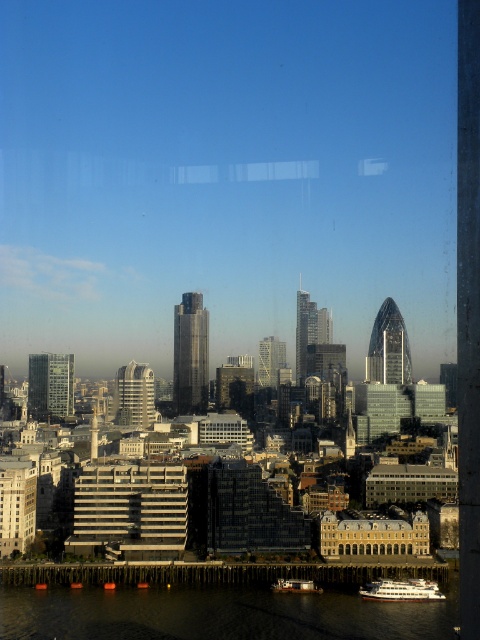
Is the position of dark water at lower center more distant than that of white glossy boat at lower right?

That is False.

Does point (386, 636) come closer to viewer compared to point (427, 589)?

Yes, it is.

At what (x,y) coordinates should I click in order to perform the action: click on dark water at lower center. Please return your answer as a coordinate pair (x, y). The width and height of the screenshot is (480, 640). Looking at the image, I should click on (216, 614).

Which is more to the right, white glossy boat at lower right or metallic gray boat at lower center?

white glossy boat at lower right is more to the right.

From the picture: Which of these two, white glossy boat at lower right or metallic gray boat at lower center, stands shorter?

metallic gray boat at lower center is shorter.

I want to click on white glossy boat at lower right, so click(x=402, y=589).

Looking at this image, is dark water at lower center to the right of metallic gray boat at lower center from the viewer's perspective?

Incorrect, dark water at lower center is not on the right side of metallic gray boat at lower center.

Between point (433, 620) and point (308, 580), which one is positioned in front?

Point (433, 620)

Is point (456, 580) farther from viewer compared to point (295, 582)?

Yes, it is behind point (295, 582).

Identify the location of dark water at lower center. The image size is (480, 640). (216, 614).